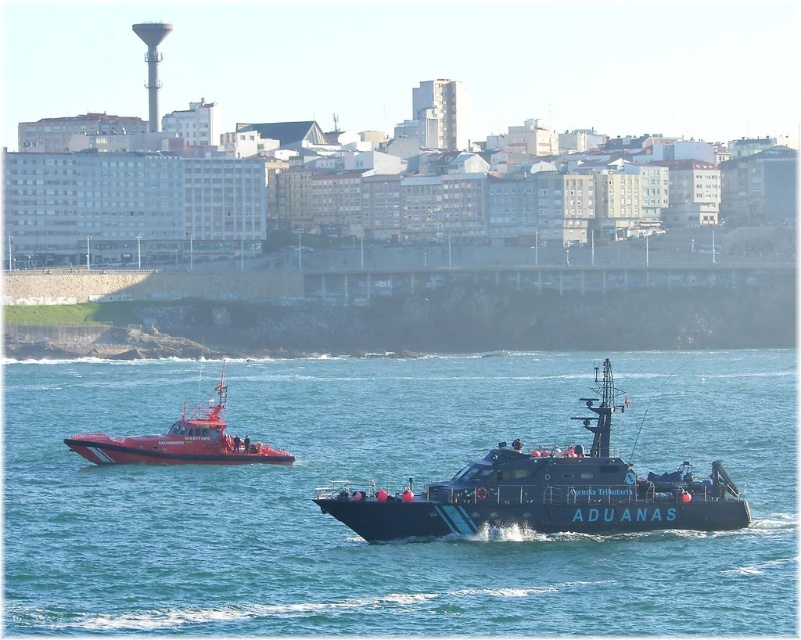
You are a sailor trying to navigate between the black matte boat at center and the red rubber boat at left. Which boat should you steer towards if you want to move towards the right side of the scene?

The black matte boat at center is positioned on the right side of the red rubber boat at left. So, to move towards the right side of the scene, you should steer towards the black matte boat at center.

You are a ship navigator and need to determine the coordinates of the black matte boat at center. What are its coordinates?

The coordinates of the black matte boat at center are at point [546,492].